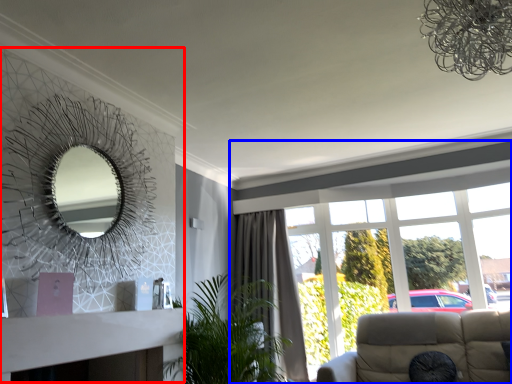
Question: Among these objects, which one is farthest to the camera, fireplace (highlighted by a red box) or window (highlighted by a blue box)?

Choices:
 (A) fireplace
 (B) window

Answer: (B)